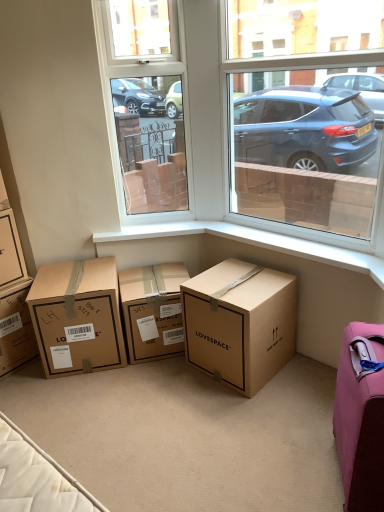
Image resolution: width=384 pixels, height=512 pixels. Describe the element at coordinates (253, 243) in the screenshot. I see `white plastic window sill at lower right` at that location.

How much space does brown cardboard box at lower center, arranged as the 1th box when viewed from the right, occupy horizontally?

The width of brown cardboard box at lower center, arranged as the 1th box when viewed from the right, is 18.98 inches.

Measure the distance between brown cardboard box at lower left, which is counted as the 3th box, starting from the left, and camera.

brown cardboard box at lower left, which is counted as the 3th box, starting from the left, is 2.25 meters from camera.

The image size is (384, 512). What do you see at coordinates (77, 316) in the screenshot?
I see `brown cardboard box at lower left, which is counted as the 3th box, starting from the left` at bounding box center [77, 316].

Measure the distance between brown cardboard box at center, the second box from the right, and camera.

They are 2.33 meters apart.

Where is `transparent glass window at upper right, positioned as the second window screen in left-to-right order`? This screenshot has width=384, height=512. transparent glass window at upper right, positioned as the second window screen in left-to-right order is located at coordinates (307, 148).

How much space does brown cardboard box at lower left, which is counted as the 5th box, starting from the right, occupy horizontally?

The width of brown cardboard box at lower left, which is counted as the 5th box, starting from the right, is 19.61 inches.

Find the location of a particular element. This screenshot has width=384, height=512. brown cardboard box at lower left, the 1th box positioned from the left is located at coordinates (16, 327).

Find the location of a particular element. The height and width of the screenshot is (512, 384). white plastic window sill at lower right is located at coordinates (253, 243).

Could you measure the distance between transparent glass window at center, acting as the 2th window screen starting from the right, and white plastic window sill at lower right?

transparent glass window at center, acting as the 2th window screen starting from the right, is 24.66 inches from white plastic window sill at lower right.

From the image's perspective, would you say transparent glass window at center, acting as the 2th window screen starting from the right, is shown under white plastic window sill at lower right?

No, from the image's perspective, transparent glass window at center, acting as the 2th window screen starting from the right, is not below white plastic window sill at lower right.

Is transparent glass window at center, acting as the 2th window screen starting from the right, facing away from white plastic window sill at lower right?

That's not correct — transparent glass window at center, acting as the 2th window screen starting from the right, is not looking away from white plastic window sill at lower right.

Can you tell me how much transparent glass window at center, acting as the 2th window screen starting from the right, and white plastic window sill at lower right differ in facing direction?

The facing directions of transparent glass window at center, acting as the 2th window screen starting from the right, and white plastic window sill at lower right are 50.1 degrees apart.

Considering the relative sizes of brown cardboard box at lower left, the 1th box positioned from the left, and brown cardboard box at center, arranged as the 4th box when viewed from the left, in the image provided, is brown cardboard box at lower left, the 1th box positioned from the left, wider than brown cardboard box at center, arranged as the 4th box when viewed from the left,?

Yes, brown cardboard box at lower left, the 1th box positioned from the left, is wider than brown cardboard box at center, arranged as the 4th box when viewed from the left.

From their relative heights in the image, would you say brown cardboard box at lower left, which is counted as the 5th box, starting from the right, is taller or shorter than brown cardboard box at center, the second box from the right?

Clearly, brown cardboard box at lower left, which is counted as the 5th box, starting from the right, is taller compared to brown cardboard box at center, the second box from the right.

Does point (12, 338) appear closer or farther from the camera than point (128, 308)?

Point (12, 338) appears to be farther away from the viewer than point (128, 308).

From a real-world perspective, which is physically above, brown cardboard box at lower left, which is counted as the 5th box, starting from the right, or brown cardboard box at center, arranged as the 4th box when viewed from the left?

From a 3D spatial view, brown cardboard box at lower left, which is counted as the 5th box, starting from the right, is above.

Image resolution: width=384 pixels, height=512 pixels. What are the coordinates of `the 3rd box to the right of the brown cardboard box at left, which ranks as the second box in left-to-right order, starting your count from the anchor` in the screenshot? It's located at (240, 323).

Consider the image. From a real-world perspective, which is physically above, brown cardboard box at lower center, which is the 5th box in left-to-right order, or brown cardboard box at left, which ranks as the second box in left-to-right order?

brown cardboard box at left, which ranks as the second box in left-to-right order, from a real-world perspective.

Is brown cardboard box at lower center, which is the 5th box in left-to-right order, outside of brown cardboard box at left, arranged as the 4th box when viewed from the right?

Indeed, brown cardboard box at lower center, which is the 5th box in left-to-right order, is completely outside brown cardboard box at left, arranged as the 4th box when viewed from the right.

Is brown cardboard box at lower center, arranged as the 1th box when viewed from the right, wider than brown cardboard box at left, which ranks as the second box in left-to-right order?

Indeed, brown cardboard box at lower center, arranged as the 1th box when viewed from the right, has a greater width compared to brown cardboard box at left, which ranks as the second box in left-to-right order.

From their relative heights in the image, would you say brown cardboard box at lower left, which is counted as the 3th box, starting from the left, is taller or shorter than transparent glass window at upper right, positioned as the second window screen in left-to-right order?

Clearly, brown cardboard box at lower left, which is counted as the 3th box, starting from the left, is shorter compared to transparent glass window at upper right, positioned as the second window screen in left-to-right order.

Is brown cardboard box at lower left, marked as the 3th box in a right-to-left arrangement, turned away from transparent glass window at upper right, positioned as the second window screen in left-to-right order?

brown cardboard box at lower left, marked as the 3th box in a right-to-left arrangement, is not turned away from transparent glass window at upper right, positioned as the second window screen in left-to-right order.

From a real-world perspective, relative to transparent glass window at upper right, positioned as the second window screen in left-to-right order, is brown cardboard box at lower left, which is counted as the 3th box, starting from the left, vertically above or below?

Clearly, from a real-world perspective, brown cardboard box at lower left, which is counted as the 3th box, starting from the left, is below transparent glass window at upper right, positioned as the second window screen in left-to-right order.

From the image's perspective, which one is positioned higher, white plastic window sill at lower right or transparent glass window at center, the first window screen from the left?

From the image's view, transparent glass window at center, the first window screen from the left, is above.

From a real-world perspective, which object stands above the other?

From a 3D spatial view, transparent glass window at center, acting as the 2th window screen starting from the right, is above.

Where is `window sill beneath the transparent glass window at center, acting as the 2th window screen starting from the right (from a real-world perspective)`? window sill beneath the transparent glass window at center, acting as the 2th window screen starting from the right (from a real-world perspective) is located at coordinates (253, 243).

Is point (338, 253) closer or farther from the camera than point (167, 106)?

Point (338, 253).

Considering the relative sizes of pink fabric suitcase at lower right and white plastic window sill at lower right in the image provided, is pink fabric suitcase at lower right bigger than white plastic window sill at lower right?

Yes.

Locate an element on the screen. The height and width of the screenshot is (512, 384). window sill that appears behind the pink fabric suitcase at lower right is located at coordinates (253, 243).

Is pink fabric suitcase at lower right positioned with its back to white plastic window sill at lower right?

No, pink fabric suitcase at lower right's orientation is not away from white plastic window sill at lower right.

Considering the relative sizes of white plastic window sill at lower right and brown cardboard box at center, arranged as the 4th box when viewed from the left, in the image provided, is white plastic window sill at lower right shorter than brown cardboard box at center, arranged as the 4th box when viewed from the left,?

Indeed, white plastic window sill at lower right has a lesser height compared to brown cardboard box at center, arranged as the 4th box when viewed from the left.

Is point (139, 227) positioned after point (138, 292)?

Yes.

Identify the location of box that is the 5th object located behind the white plastic window sill at lower right. The width and height of the screenshot is (384, 512). (153, 310).

Considering the relative sizes of white plastic window sill at lower right and brown cardboard box at center, the second box from the right, in the image provided, is white plastic window sill at lower right bigger than brown cardboard box at center, the second box from the right,?

Actually, white plastic window sill at lower right might be smaller than brown cardboard box at center, the second box from the right.

Find the location of a particular element. window sill that appears below the transparent glass window at center, acting as the 2th window screen starting from the right (from a real-world perspective) is located at coordinates (253, 243).

From a real-world perspective, count 1st boxs upward from the brown cardboard box at center, the second box from the right, and point to it. Please provide its 2D coordinates.

[(16, 327)]

Estimate the real-world distances between objects in this image. Which object is further from transparent glass window at upper right, positioned as the second window screen in left-to-right order, transparent glass window at center, acting as the 2th window screen starting from the right, or white plastic window sill at lower right?

Among the two, white plastic window sill at lower right is located further to transparent glass window at upper right, positioned as the second window screen in left-to-right order.

Which object lies further to the anchor point transparent glass window at upper right, the 1th window screen in the right-to-left sequence, brown cardboard box at lower left, which is counted as the 5th box, starting from the right, or brown cardboard box at center, arranged as the 4th box when viewed from the left?

brown cardboard box at lower left, which is counted as the 5th box, starting from the right, is further to transparent glass window at upper right, the 1th window screen in the right-to-left sequence.

Considering their positions, is brown cardboard box at left, arranged as the 4th box when viewed from the right, positioned closer to brown cardboard box at lower center, arranged as the 1th box when viewed from the right, than brown cardboard box at lower left, which is counted as the 3th box, starting from the left?

brown cardboard box at lower left, which is counted as the 3th box, starting from the left, lies closer to brown cardboard box at lower center, arranged as the 1th box when viewed from the right, than the other object.

From the image, which object appears to be nearer to transparent glass window at upper right, positioned as the second window screen in left-to-right order, brown cardboard box at center, arranged as the 4th box when viewed from the left, or brown cardboard box at lower left, marked as the 3th box in a right-to-left arrangement?

The object closer to transparent glass window at upper right, positioned as the second window screen in left-to-right order, is brown cardboard box at center, arranged as the 4th box when viewed from the left.

From the image, which object appears to be nearer to brown cardboard box at center, the second box from the right, transparent glass window at upper right, the 1th window screen in the right-to-left sequence, or brown cardboard box at lower center, arranged as the 1th box when viewed from the right?

Among the two, brown cardboard box at lower center, arranged as the 1th box when viewed from the right, is located nearer to brown cardboard box at center, the second box from the right.

In the scene shown: Based on their spatial positions, is transparent glass window at upper right, the 1th window screen in the right-to-left sequence, or brown cardboard box at lower center, which is the 5th box in left-to-right order, further from pink fabric suitcase at lower right?

Based on the image, transparent glass window at upper right, the 1th window screen in the right-to-left sequence, appears to be further to pink fabric suitcase at lower right.

Estimate the real-world distances between objects in this image. Which object is further from pink fabric suitcase at lower right, transparent glass window at upper right, the 1th window screen in the right-to-left sequence, or brown cardboard box at lower left, the 1th box positioned from the left?

transparent glass window at upper right, the 1th window screen in the right-to-left sequence, lies further to pink fabric suitcase at lower right than the other object.

When comparing their distances from brown cardboard box at lower left, which is counted as the 5th box, starting from the right, does brown cardboard box at lower center, which is the 5th box in left-to-right order, or white plastic window sill at lower right seem further?

Based on the image, brown cardboard box at lower center, which is the 5th box in left-to-right order, appears to be further to brown cardboard box at lower left, which is counted as the 5th box, starting from the right.

The width and height of the screenshot is (384, 512). I want to click on box between brown cardboard box at lower left, the 1th box positioned from the left, and brown cardboard box at lower left, which is counted as the 3th box, starting from the left, so click(x=10, y=250).

In order to click on window sill located between pink fabric suitcase at lower right and brown cardboard box at center, the second box from the right, in the depth direction in this screenshot , I will do point(253,243).

The height and width of the screenshot is (512, 384). I want to click on box between brown cardboard box at lower left, marked as the 3th box in a right-to-left arrangement, and brown cardboard box at lower center, arranged as the 1th box when viewed from the right, in the horizontal direction, so click(x=153, y=310).

This screenshot has width=384, height=512. I want to click on window screen between transparent glass window at center, the first window screen from the left, and white plastic window sill at lower right, so click(x=307, y=148).